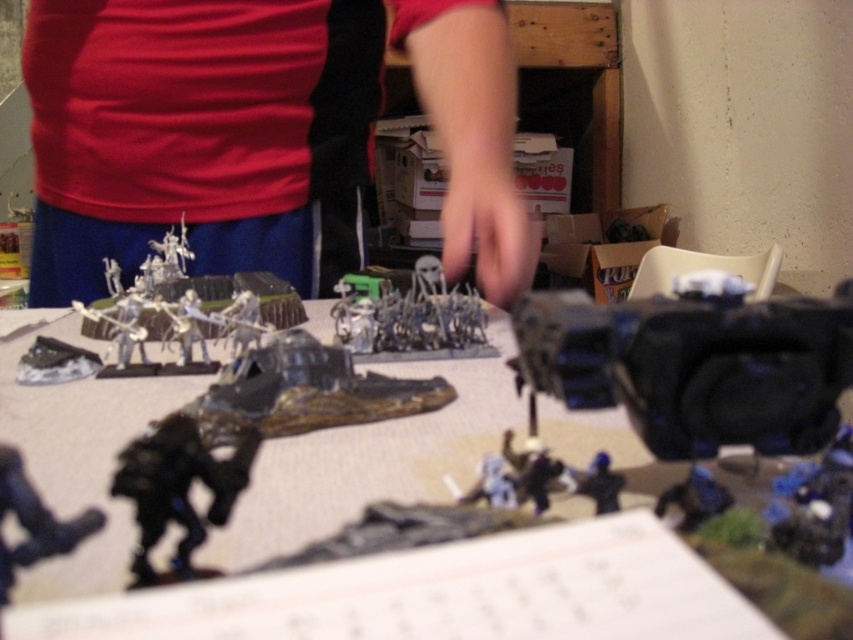
You are a game master standing at the edge of the table. You need to place a new miniature figure that is 16 inches long onto the table. Can you fit it between the shiny metallic tank at center and the edge of the table without moving any other figures?

The shiny metallic tank at center is 15.91 inches away from the camera. Since the new miniature figure is 16 inches long, it would not fit between the shiny metallic tank at center and the edge of the table as there is insufficient space.

You are a player in a tabletop game and want to move your shiny metallic tank at center closer to the satin silver miniature army at center. Can you move the tank directly towards the army without any obstruction?

The shiny metallic tank at center is in front of the satin silver miniature army at center, so moving the tank directly towards the army would bring them closer without obstruction as the tank is already positioned in front.